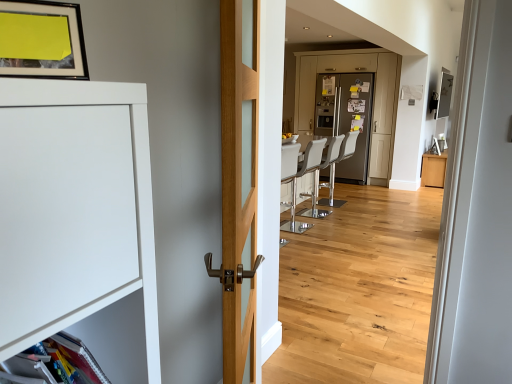
Question: Is white leather barstool at center, acting as the 1th armchair starting from the back, at the left side of wooden floor at center?

Choices:
 (A) yes
 (B) no

Answer: (B)

Question: Is white leather barstool at center, acting as the 1th armchair starting from the back, in front of wooden floor at center?

Choices:
 (A) yes
 (B) no

Answer: (B)

Question: Would you say white leather barstool at center, acting as the 1th armchair starting from the back, contains wooden floor at center?

Choices:
 (A) no
 (B) yes

Answer: (A)

Question: Does white leather barstool at center, the 3th armchair in the front-to-back sequence, appear on the right side of wooden floor at center?

Choices:
 (A) no
 (B) yes

Answer: (B)

Question: Can you confirm if white leather barstool at center, the 3th armchair in the front-to-back sequence, is wider than wooden floor at center?

Choices:
 (A) no
 (B) yes

Answer: (B)

Question: Based on their positions, is light oak wood door at center located to the left or right of matte black picture frame at upper left?

Choices:
 (A) left
 (B) right

Answer: (B)

Question: Considering the positions of light oak wood door at center and matte black picture frame at upper left in the image, is light oak wood door at center wider or thinner than matte black picture frame at upper left?

Choices:
 (A) wide
 (B) thin

Answer: (A)

Question: Looking at the image, does light oak wood door at center seem bigger or smaller compared to matte black picture frame at upper left?

Choices:
 (A) small
 (B) big

Answer: (B)

Question: Would you say light oak wood door at center is inside or outside matte black picture frame at upper left?

Choices:
 (A) inside
 (B) outside

Answer: (B)

Question: Is satin silver refrigerator at center, arranged as the second screen door when viewed from the right, in front of or behind white leather barstool at center, acting as the 3th armchair starting from the back, in the image?

Choices:
 (A) front
 (B) behind

Answer: (B)

Question: From a real-world perspective, is satin silver refrigerator at center, positioned as the first screen door in left-to-right order, above or below white leather barstool at center, which appears as the 1th armchair when viewed from the front?

Choices:
 (A) above
 (B) below

Answer: (A)

Question: From the image's perspective, relative to white leather barstool at center, acting as the 3th armchair starting from the back, is satin silver refrigerator at center, arranged as the second screen door when viewed from the right, above or below?

Choices:
 (A) below
 (B) above

Answer: (B)

Question: Would you say satin silver refrigerator at center, positioned as the first screen door in left-to-right order, is to the left or to the right of white leather barstool at center, which appears as the 1th armchair when viewed from the front, in the picture?

Choices:
 (A) right
 (B) left

Answer: (A)

Question: Looking at their shapes, would you say white leather barstool at center, which appears as the 1th armchair when viewed from the front, is wider or thinner than wooden floor at center?

Choices:
 (A) wide
 (B) thin

Answer: (A)

Question: From the image's perspective, is white leather barstool at center, acting as the 3th armchair starting from the back, above or below wooden floor at center?

Choices:
 (A) above
 (B) below

Answer: (A)